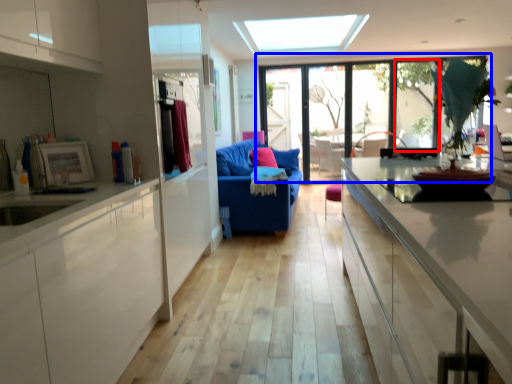
Question: Which object is closer to the camera taking this photo, window (highlighted by a red box) or window (highlighted by a blue box)?

Choices:
 (A) window
 (B) window

Answer: (B)